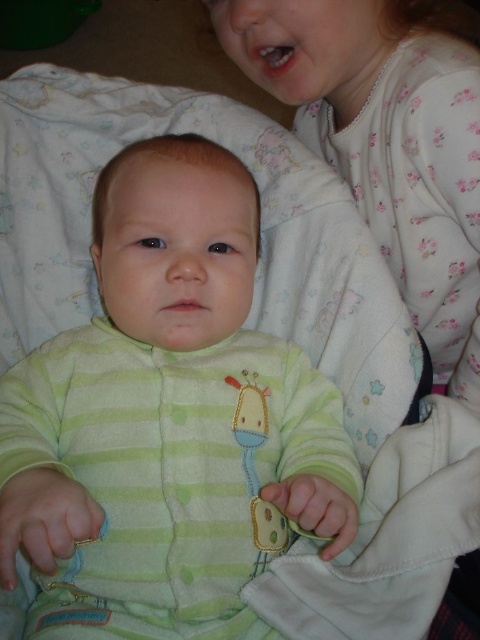
You are a photographer trying to capture a group photo of the green striped onesie at center and the white floral pajamas at upper right. If you want to ensure both are fully visible in the frame, which object should you position closer to the camera?

You should position the green striped onesie at center closer to the camera because it might be wider than the white floral pajamas at upper right, ensuring both fit within the frame.

You are a photographer trying to capture both the green striped onesie at center and the white floral pajamas at upper right in a single frame. Based on their sizes, which one should you focus on to ensure both are clearly visible?

The green striped onesie at center is larger in size than the white floral pajamas at upper right, so focusing on the larger one would allow both to be visible in the frame.

You are a parent trying to locate your baby wearing the green striped onesie at center in a room. The room has a rectangular layout with coordinates from 0 to 1 on both axes. The baby is at point 0.658, 0.350. If you are standing at the corner point 0,0, which direction should you move to find the baby?

To locate the baby wearing the green striped onesie at center, you should move towards the northeast direction from the corner point (0, 0) since the baby is located at point (168, 420), which is northeast of your current position.